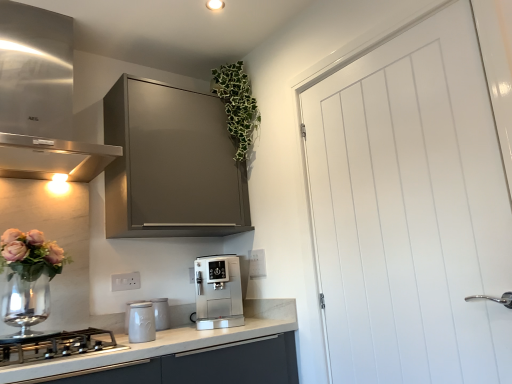
Question: Considering the positions of point (356, 221) and point (238, 324), is point (356, 221) closer or farther from the camera than point (238, 324)?

Choices:
 (A) closer
 (B) farther

Answer: (A)

Question: From the image's perspective, relative to satin silver coffee machine at center, placed as the fourth kitchen appliance when sorted from left to right, is white smooth door at right above or below?

Choices:
 (A) above
 (B) below

Answer: (A)

Question: Which object is the closest to the satin silver coffee machine at center, placed as the fourth kitchen appliance when sorted from left to right?

Choices:
 (A) white ceramic canister at center, arranged as the 3th kitchen appliance when viewed from the right
 (B) white plastic electric outlet at lower center, which is the 2th electric outlet in right-to-left order
 (C) stainless steel gas stove at lower left, acting as the 4th kitchen appliance starting from the right
 (D) green leafy plant at upper center
 (E) white ceramic jar at lower left, arranged as the third kitchen appliance when viewed from the left

Answer: (A)

Question: Estimate the real-world distances between objects in this image. Which object is closer to the white ceramic jar at lower left, positioned as the 2th kitchen appliance in right-to-left order?

Choices:
 (A) matte gray cabinet at upper center
 (B) satin silver coffee machine at center, placed as the 1th kitchen appliance when sorted from right to left
 (C) green leafy plant at upper center
 (D) white ceramic canister at center, which ranks as the second kitchen appliance in left-to-right order
 (E) white plastic electric outlet at lower center, the first electric outlet from the left

Answer: (D)